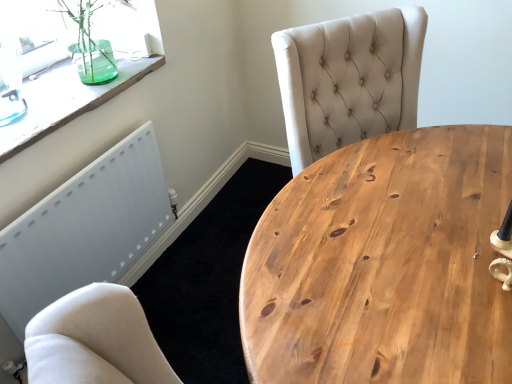
In order to face natural wood table at center, should I rotate leftwards or rightwards?

To face it directly, rotate right by 16.956 degrees.

Describe the element at coordinates (68, 98) in the screenshot. I see `transparent glass vase at upper left` at that location.

Where is `white matte radiator at lower left`? This screenshot has height=384, width=512. white matte radiator at lower left is located at coordinates (84, 229).

In the scene shown: Is transparent glass vase at upper left taller than white matte radiator at lower left?

No.

Is transparent glass vase at upper left not close to white matte radiator at lower left?

No, transparent glass vase at upper left is in close proximity to white matte radiator at lower left.

Which object is closer to the camera taking this photo, transparent glass vase at upper left or white matte radiator at lower left?

white matte radiator at lower left is in front.

Which of these two, transparent glass vase at upper left or white matte radiator at lower left, is thinner?

white matte radiator at lower left.

Does point (42, 31) lie behind point (138, 136)?

Yes, it is.

Is white matte radiator at lower left completely or partially inside transparent glass vase at upper left?

No.

Does transparent glass vase at upper left appear on the right side of white matte radiator at lower left?

No, transparent glass vase at upper left is not to the right of white matte radiator at lower left.

From a real-world perspective, relative to natural wood table at center, is white matte radiator at lower left vertically above or below?

white matte radiator at lower left is situated lower than natural wood table at center in the real world.

From the image's perspective, is white matte radiator at lower left under natural wood table at center?

Yes, from the image's perspective, white matte radiator at lower left is below natural wood table at center.

Is white matte radiator at lower left located outside natural wood table at center?

Yes.

The image size is (512, 384). What are the coordinates of `radiator below the natural wood table at center (from the image's perspective)` in the screenshot? It's located at (84, 229).

Is transparent glass vase at upper left with transparent glass vase at upper left?

transparent glass vase at upper left and transparent glass vase at upper left are clearly separated.

From a real-world perspective, is transparent glass vase at upper left physically above transparent glass vase at upper left?

No, from a real-world perspective, transparent glass vase at upper left is not over transparent glass vase at upper left

Is transparent glass vase at upper left looking in the opposite direction of transparent glass vase at upper left?

transparent glass vase at upper left does not have its back to transparent glass vase at upper left.

Considering the positions of objects transparent glass vase at upper left and transparent glass vase at upper left in the image provided, who is more to the left, transparent glass vase at upper left or transparent glass vase at upper left?

transparent glass vase at upper left.

Is transparent glass vase at upper left next to transparent glass vase at upper left?

No, transparent glass vase at upper left is not making contact with transparent glass vase at upper left.

Is transparent glass vase at upper left positioned beyond the bounds of transparent glass vase at upper left?

Absolutely, transparent glass vase at upper left is external to transparent glass vase at upper left.

Is transparent glass vase at upper left oriented towards transparent glass vase at upper left?

No, transparent glass vase at upper left is not oriented towards transparent glass vase at upper left.

Is transparent glass vase at upper left at the left side of transparent glass vase at upper left?

Correct, you'll find transparent glass vase at upper left to the left of transparent glass vase at upper left.

Can you confirm if natural wood table at center is smaller than transparent glass vase at upper left?

Incorrect, natural wood table at center is not smaller in size than transparent glass vase at upper left.

Is point (415, 355) closer to viewer compared to point (59, 86)?

Yes, point (415, 355) is closer to viewer.

Is transparent glass vase at upper left a part of natural wood table at center?

Definitely not — transparent glass vase at upper left is not inside natural wood table at center.

Looking at this image, is transparent glass vase at upper left completely or partially inside white matte radiator at lower left?

No, transparent glass vase at upper left is not inside white matte radiator at lower left.

Considering the relative sizes of white matte radiator at lower left and transparent glass vase at upper left in the image provided, is white matte radiator at lower left smaller than transparent glass vase at upper left?

Yes.

Could you tell me if white matte radiator at lower left is facing transparent glass vase at upper left?

No, white matte radiator at lower left does not turn towards transparent glass vase at upper left.

Is point (124, 141) closer or farther from the camera than point (21, 138)?

Clearly, point (124, 141) is more distant from the camera than point (21, 138).

At what (x,y) coordinates should I click in order to perform the action: click on radiator in front of the transparent glass vase at upper left. Please return your answer as a coordinate pair (x, y). Image resolution: width=512 pixels, height=384 pixels. Looking at the image, I should click on (84, 229).

Image resolution: width=512 pixels, height=384 pixels. Identify the location of window screen above the white matte radiator at lower left (from the image's perspective). (34, 32).

Which object lies nearer to the anchor point transparent glass vase at upper left, natural wood table at center or transparent glass vase at upper left?

transparent glass vase at upper left lies closer to transparent glass vase at upper left than the other object.

Estimate the real-world distances between objects in this image. Which object is further from natural wood table at center, white matte radiator at lower left or transparent glass vase at upper left?

transparent glass vase at upper left is further to natural wood table at center.

From the image, which object appears to be farther from natural wood table at center, transparent glass vase at upper left or white matte radiator at lower left?

Among the two, transparent glass vase at upper left is located further to natural wood table at center.

When comparing their distances from transparent glass vase at upper left, does transparent glass vase at upper left or natural wood table at center seem further?

natural wood table at center.

When comparing their distances from natural wood table at center, does white matte radiator at lower left or transparent glass vase at upper left seem closer?

white matte radiator at lower left lies closer to natural wood table at center than the other object.

Looking at this image, which object lies nearer to the anchor point white matte radiator at lower left, transparent glass vase at upper left or transparent glass vase at upper left?

transparent glass vase at upper left lies closer to white matte radiator at lower left than the other object.

Looking at the image, which one is located closer to white matte radiator at lower left, natural wood table at center or transparent glass vase at upper left?

The object closer to white matte radiator at lower left is transparent glass vase at upper left.

Considering their positions, is natural wood table at center positioned further to transparent glass vase at upper left than white matte radiator at lower left?

The object further to transparent glass vase at upper left is natural wood table at center.

The height and width of the screenshot is (384, 512). In order to click on radiator between transparent glass vase at upper left and natural wood table at center from left to right in this screenshot , I will do `click(84, 229)`.

Locate an element on the screen. The width and height of the screenshot is (512, 384). window between white matte radiator at lower left and natural wood table at center from left to right is located at coordinates (68, 98).

Locate an element on the screen. window situated between transparent glass vase at upper left and natural wood table at center from left to right is located at coordinates (68, 98).

The height and width of the screenshot is (384, 512). Find the location of `window screen between transparent glass vase at upper left and white matte radiator at lower left in the vertical direction`. window screen between transparent glass vase at upper left and white matte radiator at lower left in the vertical direction is located at coordinates (34, 32).